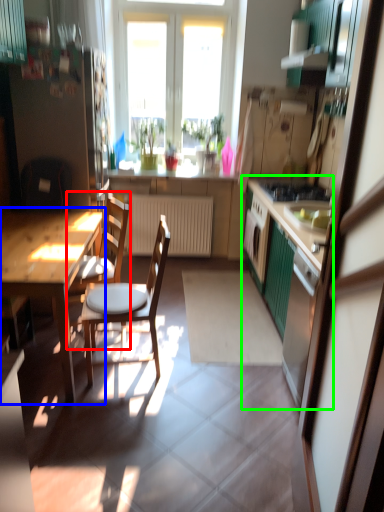
Question: Which object is the closest to the chair (highlighted by a red box)? Choose among these: table (highlighted by a blue box) or cabinetry (highlighted by a green box).

Choices:
 (A) table
 (B) cabinetry

Answer: (A)